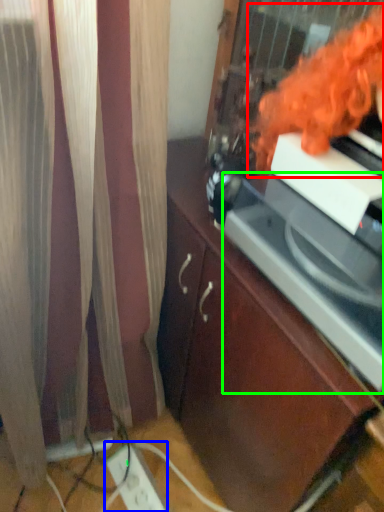
Question: Which object is the farthest from woman (highlighted by a red box)? Choose among these: extension cord (highlighted by a blue box) or appliance (highlighted by a green box).

Choices:
 (A) extension cord
 (B) appliance

Answer: (A)